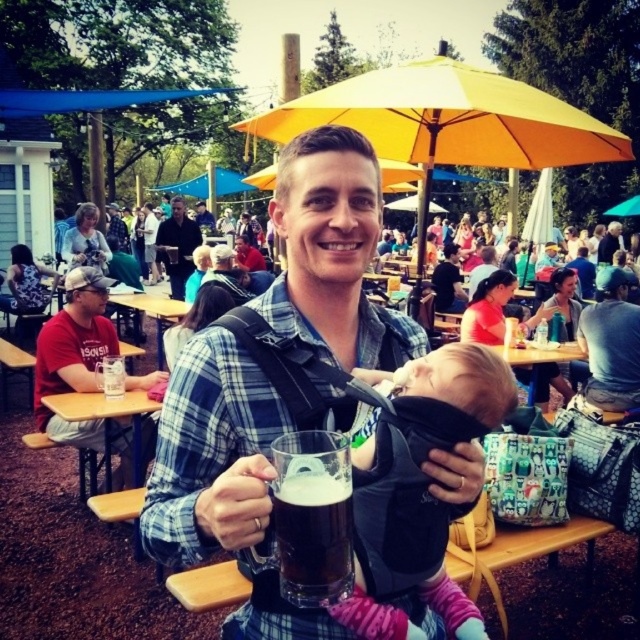
Is yellow fabric umbrella at upper center above soft pink fabric baby at center?

Yes, yellow fabric umbrella at upper center is above soft pink fabric baby at center.

Based on the photo, who is more forward, (x=285, y=241) or (x=428, y=570)?

Point (x=428, y=570) is more forward.

The image size is (640, 640). Describe the element at coordinates (449, 124) in the screenshot. I see `yellow fabric umbrella at upper center` at that location.

The image size is (640, 640). In order to click on yellow fabric umbrella at upper center in this screenshot , I will do `click(449, 124)`.

Does matte black shirt at upper center appear under smooth black shirt at center?

Yes.

Between point (109, 227) and point (204, 227), which one is positioned behind?

The point (204, 227) is behind.

The height and width of the screenshot is (640, 640). Identify the location of matte black shirt at upper center. (116, 228).

I want to click on matte black shirt at upper center, so click(116, 228).

Does blue plaid shirt at center appear on the right side of red cotton shirt at left?

Yes, blue plaid shirt at center is to the right of red cotton shirt at left.

This screenshot has height=640, width=640. I want to click on blue plaid shirt at center, so pyautogui.click(x=220, y=449).

This screenshot has height=640, width=640. What are the coordinates of `blue plaid shirt at center` in the screenshot? It's located at (220, 449).